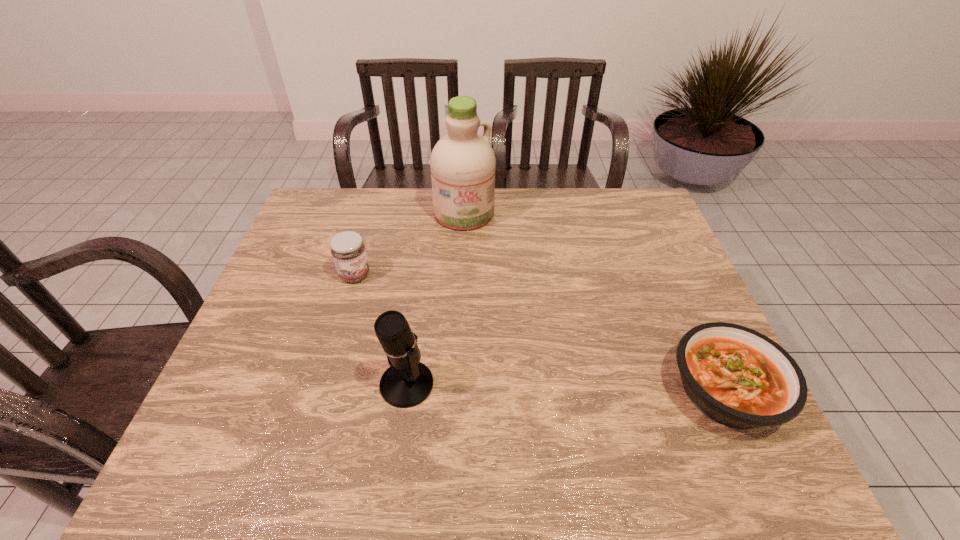
Where is `free space at the far edge`? The height and width of the screenshot is (540, 960). free space at the far edge is located at coordinates (574, 188).

You are a GUI agent. You are given a task and a screenshot of the screen. Output one action in this format:
    pyautogui.click(x=<x>, y=<y>)
    Task: Click on the vacant region at the left edge of the desktop
    Image resolution: width=960 pixels, height=540 pixels.
    Given the screenshot: What is the action you would take?
    pyautogui.click(x=285, y=387)

At what (x,y) coordinates should I click in order to perform the action: click on blank space at the right edge of the desktop. Please return your answer as a coordinate pair (x, y). Looking at the image, I should click on (676, 385).

Locate an element on the screen. vacant space at the far left corner of the desktop is located at coordinates (331, 203).

Image resolution: width=960 pixels, height=540 pixels. In the image, there is a desktop. Identify the location of vacant space at the far right corner. (624, 229).

At what (x,y) coordinates should I click in order to perform the action: click on vacant region between the second farthest object and the cleansing agent. Please return your answer as a coordinate pair (x, y). The width and height of the screenshot is (960, 540). Looking at the image, I should click on [x=410, y=244].

Where is `blank region between the third nearest object and the stew`? This screenshot has width=960, height=540. blank region between the third nearest object and the stew is located at coordinates (540, 333).

You are a GUI agent. You are given a task and a screenshot of the screen. Output one action in this format:
    pyautogui.click(x=<x>, y=<y>)
    Task: Click on the vacant space in between the stew and the cleansing agent
    
    Given the screenshot: What is the action you would take?
    pyautogui.click(x=594, y=302)

You are a GUI agent. You are given a task and a screenshot of the screen. Output one action in this format:
    pyautogui.click(x=<x>, y=<y>)
    Task: Click on the empty space between the shortest object and the farthest object
    The width and height of the screenshot is (960, 540).
    Given the screenshot: What is the action you would take?
    pyautogui.click(x=594, y=302)

This screenshot has width=960, height=540. I want to click on free space between the rightmost object and the cleansing agent, so click(x=594, y=302).